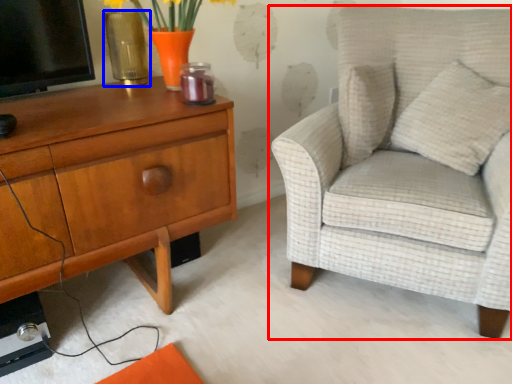
Question: Among these objects, which one is farthest to the camera, chair (highlighted by a red box) or vase (highlighted by a blue box)?

Choices:
 (A) chair
 (B) vase

Answer: (B)